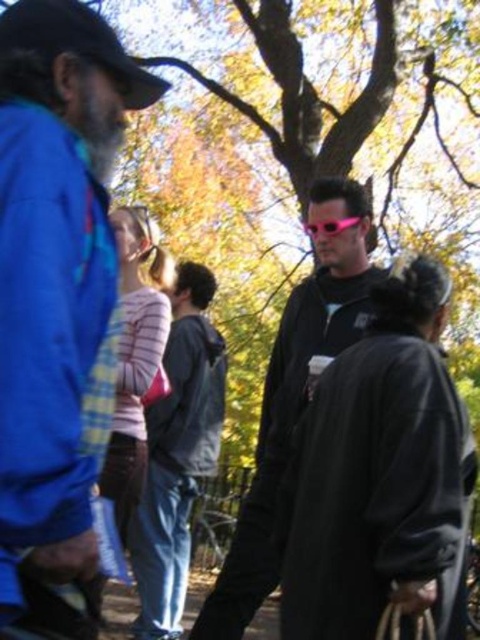
You are trying to determine if the dark gray hoodie at center can completely cover the pink plastic goggles at center. Based on their sizes, is this possible?

The dark gray hoodie at center might be wider than pink plastic goggles at center, so it is possible that the dark gray hoodie at center can cover the pink plastic goggles at center if positioned correctly.